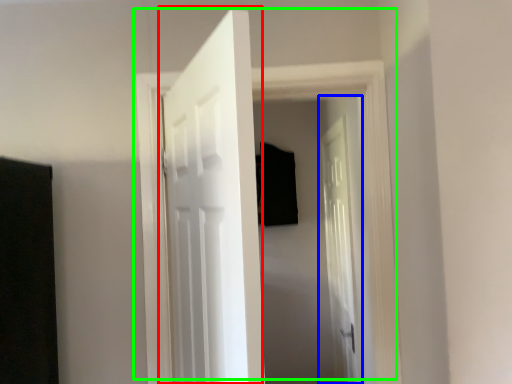
Question: Which object is the farthest from door (highlighted by a red box)? Choose among these: door (highlighted by a blue box) or door (highlighted by a green box).

Choices:
 (A) door
 (B) door

Answer: (A)